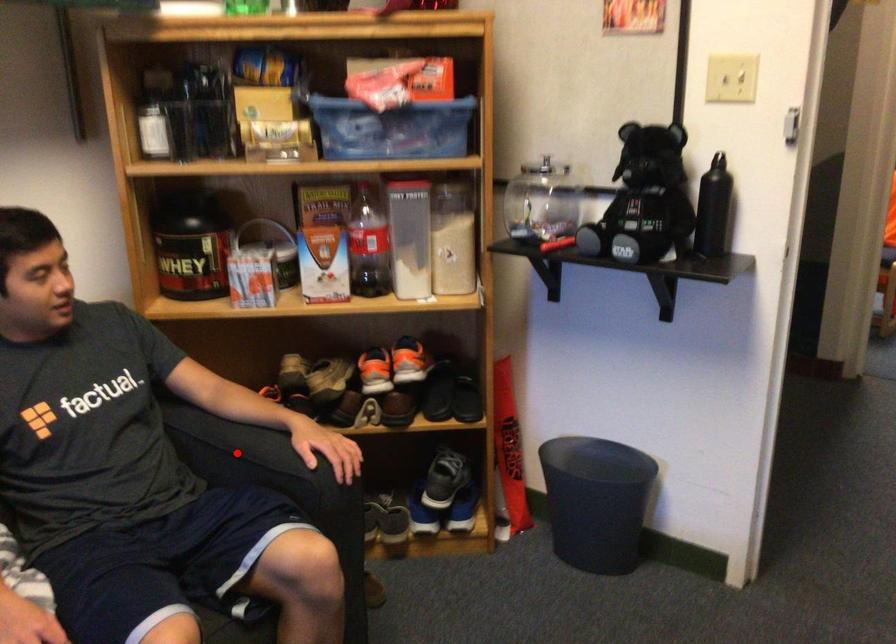
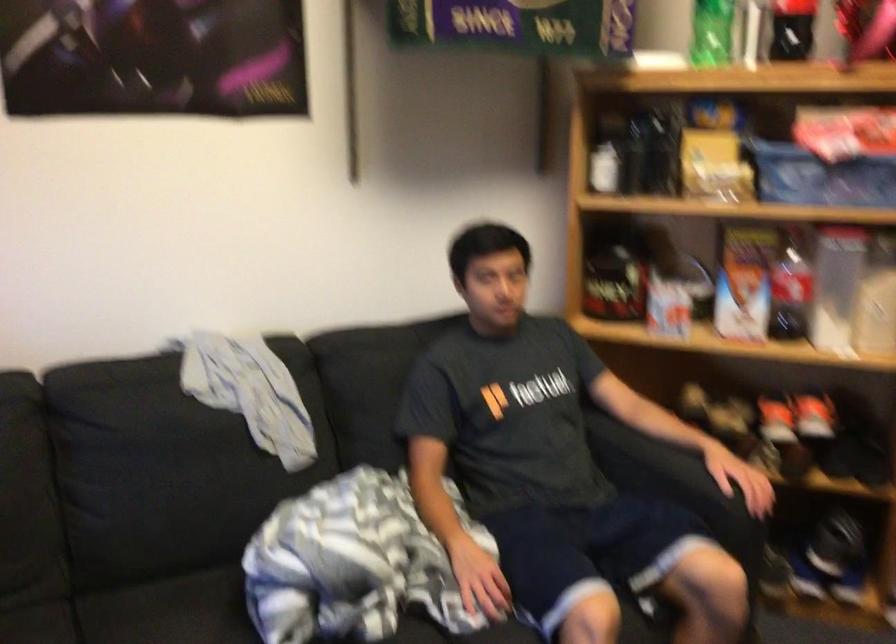
Locate, in the second image, the point that corresponds to the highlighted location in the first image.

(650, 464)